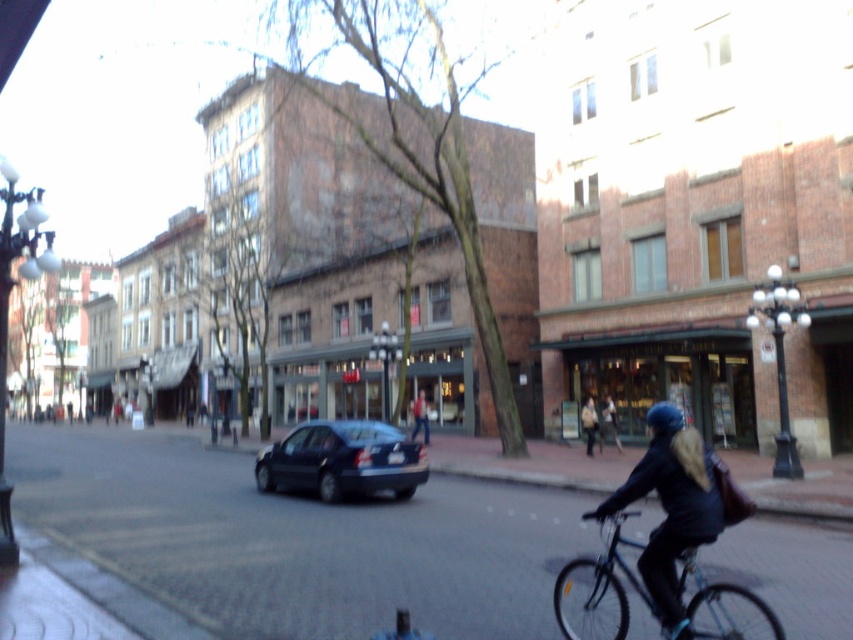
Question: Estimate the real-world distances between objects in this image. Which object is closer to the shiny dark blue sedan at center?

Choices:
 (A) dark blue jacket at center
 (B) dark blue helmet at center
 (C) blue metallic bicycle at lower right

Answer: (B)

Question: Considering the real-world distances, which object is closest to the dark blue jacket at center?

Choices:
 (A) dark blue helmet at center
 (B) blue metallic bicycle at lower right

Answer: (A)

Question: From the image, what is the correct spatial relationship of dark blue helmet at center in relation to shiny dark blue sedan at center?

Choices:
 (A) below
 (B) above

Answer: (B)

Question: Does blue metallic bicycle at lower right have a greater width compared to dark blue jacket at center?

Choices:
 (A) yes
 (B) no

Answer: (A)

Question: Which object is the closest to the shiny dark blue sedan at center?

Choices:
 (A) dark blue jacket at center
 (B) blue metallic bicycle at lower right
 (C) dark blue helmet at center

Answer: (C)

Question: Does dark blue helmet at center appear over shiny dark blue sedan at center?

Choices:
 (A) no
 (B) yes

Answer: (B)